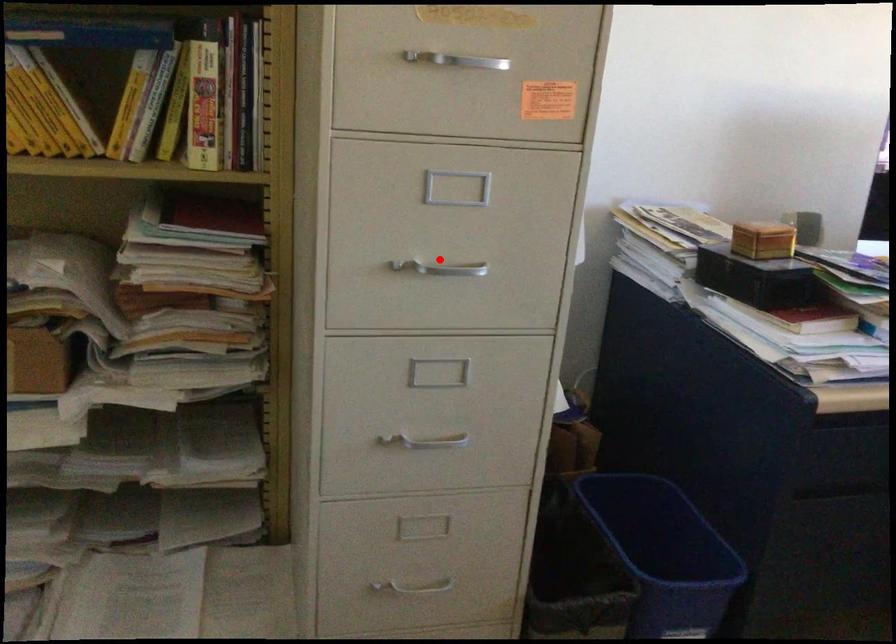
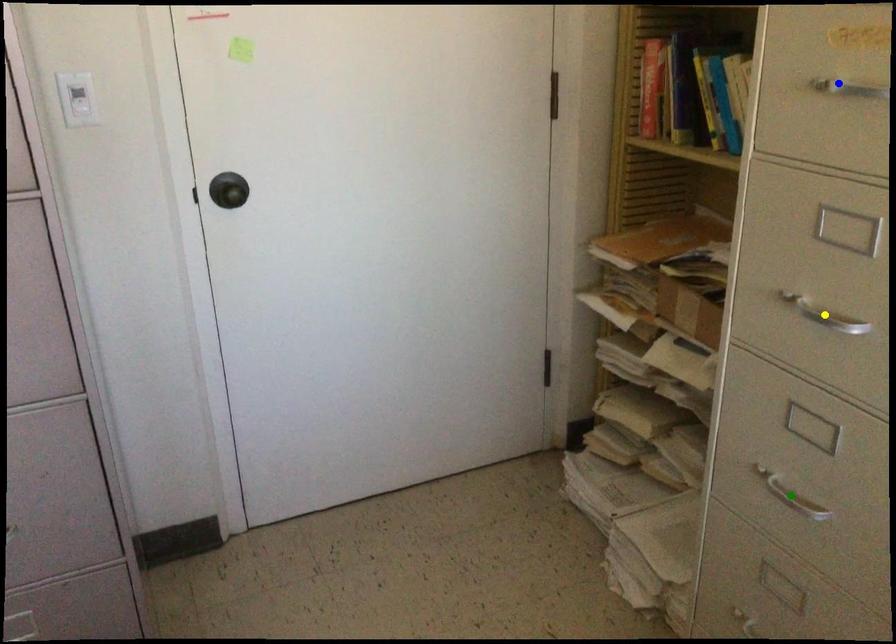
Question: I am providing you with two images of the same scene from different viewpoints. A red point is marked on the first image. You are given multiple points on the second image. Which mark in image 2 goes with the point in image 1?

Choices:
 (A) blue point
 (B) green point
 (C) yellow point

Answer: (C)